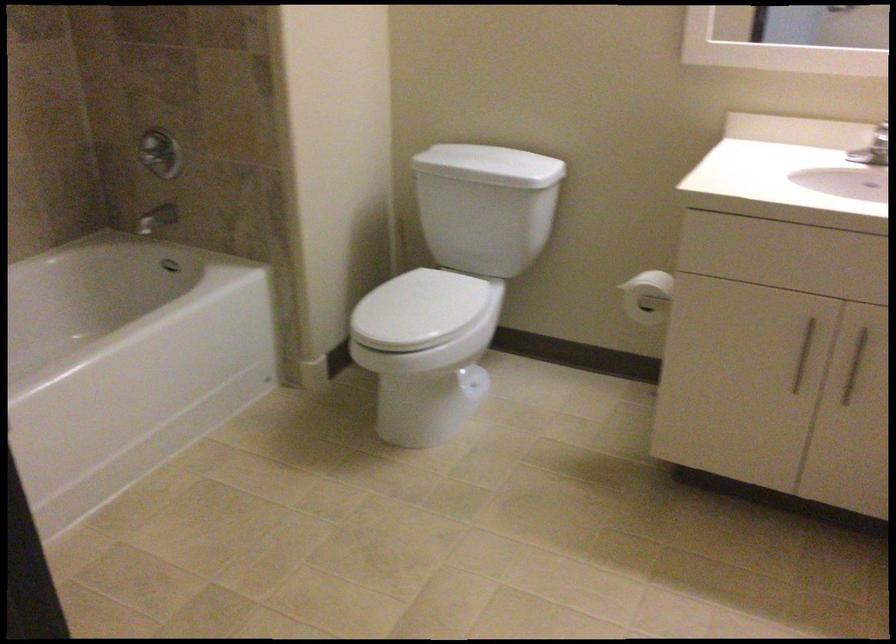
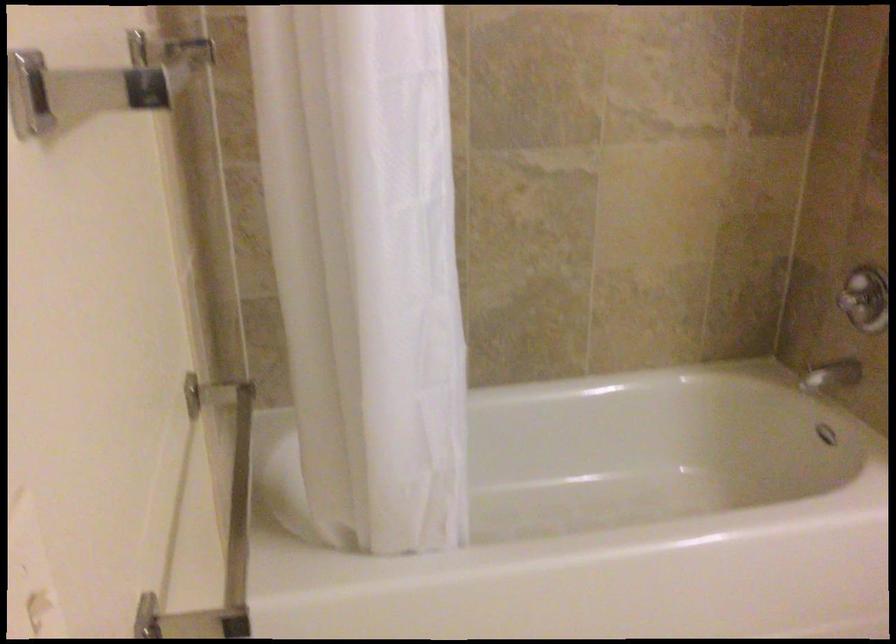
Question: How did the camera likely rotate?

Choices:
 (A) Left
 (B) Right
 (C) Up
 (D) Down

Answer: (A)